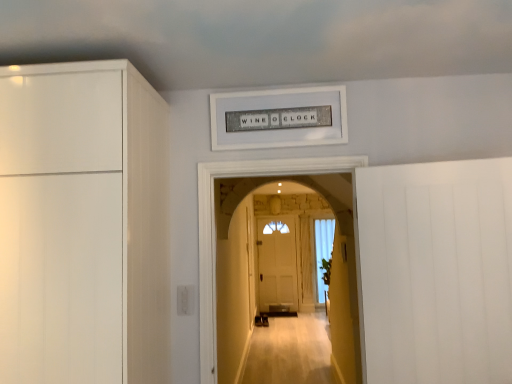
Question: From the image's perspective, relative to white textured sign at upper center, is smooth beige carpet at center above or below?

Choices:
 (A) above
 (B) below

Answer: (B)

Question: Would you say smooth beige carpet at center is inside or outside white textured sign at upper center?

Choices:
 (A) outside
 (B) inside

Answer: (A)

Question: Which object is the farthest from the white glossy cabinet at left?

Choices:
 (A) smooth beige carpet at center
 (B) white matte door at right
 (C) white sheer curtain at center
 (D) white textured sign at upper center

Answer: (C)

Question: Based on their relative distances, which object is nearer to the white glossy cabinet at left?

Choices:
 (A) white sheer curtain at center
 (B) smooth beige carpet at center
 (C) white textured sign at upper center
 (D) white matte door at right

Answer: (B)